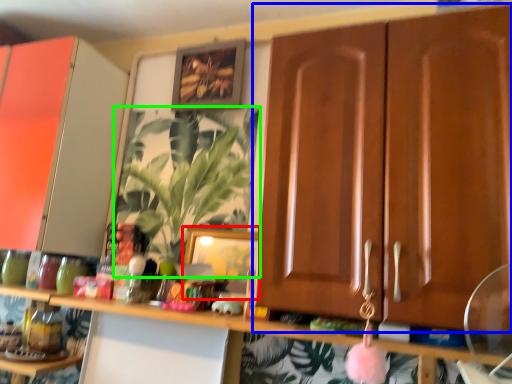
Question: Estimate the real-world distances between objects in this image. Which object is closer to picture frame (highlighted by a red box), cabinetry (highlighted by a blue box) or houseplant (highlighted by a green box)?

Choices:
 (A) cabinetry
 (B) houseplant

Answer: (B)